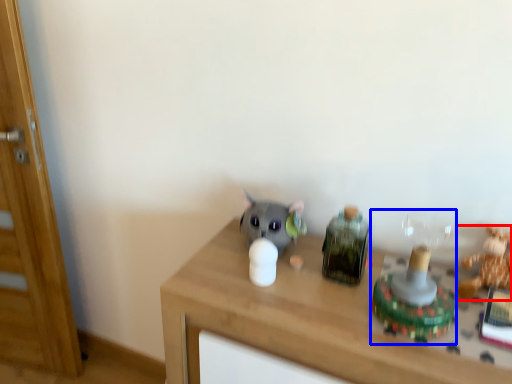
Question: Which object appears closest to the camera in this image, toy (highlighted by a red box) or toy (highlighted by a blue box)?

Choices:
 (A) toy
 (B) toy

Answer: (B)